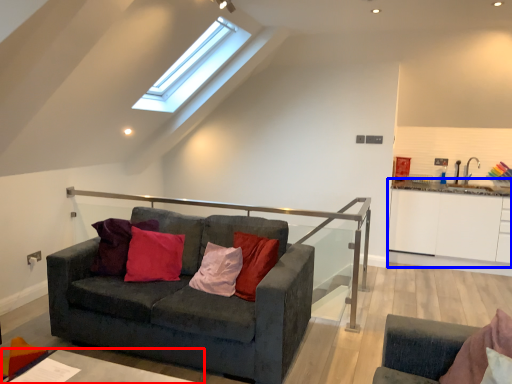
Question: Among these objects, which one is nearest to the camera, table (highlighted by a red box) or cabinetry (highlighted by a blue box)?

Choices:
 (A) table
 (B) cabinetry

Answer: (A)